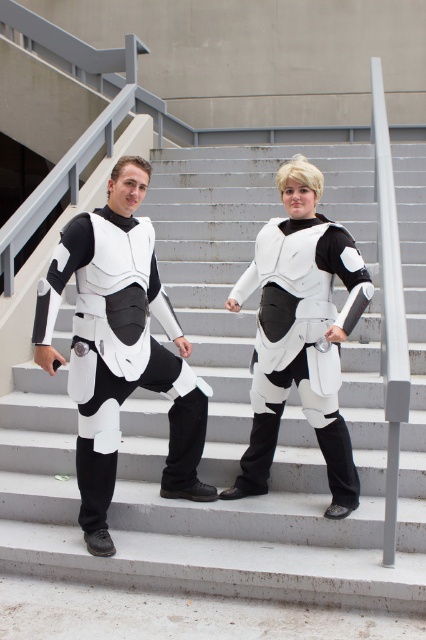
Is the position of white smooth stairs at center more distant than that of white matte armor at center?

No, it is not.

Between white smooth stairs at center and white matte armor at center, which one appears on the left side from the viewer's perspective?

From the viewer's perspective, white smooth stairs at center appears more on the left side.

Between point (190, 150) and point (255, 436), which one is positioned in front?

Point (255, 436) is more forward.

At what (x,y) coordinates should I click in order to perform the action: click on white smooth stairs at center. Please return your answer as a coordinate pair (x, y). Looking at the image, I should click on (241, 499).

Is matte white armor at center below white matte armor at center?

Actually, matte white armor at center is above white matte armor at center.

Is point (135, 278) closer to camera compared to point (310, 392)?

Yes, point (135, 278) is closer to viewer.

Which is behind, point (140, 252) or point (250, 483)?

The point (250, 483) is more distant.

Where is `matte white armor at center`? matte white armor at center is located at coordinates (120, 348).

Does point (238, 173) lie in front of point (126, 387)?

No, (238, 173) is behind (126, 387).

What do you see at coordinates (241, 499) in the screenshot? The image size is (426, 640). I see `white smooth stairs at center` at bounding box center [241, 499].

Is point (244, 244) positioned before point (100, 531)?

No, (244, 244) is further to viewer.

Where is `white smooth stairs at center`? This screenshot has width=426, height=640. white smooth stairs at center is located at coordinates (241, 499).